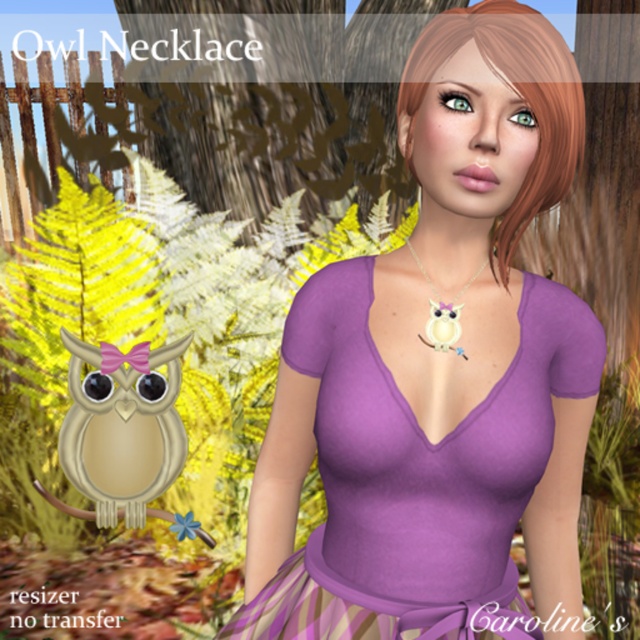
Question: Does purple matte dress at center appear on the right side of matte beige owl at center?

Choices:
 (A) no
 (B) yes

Answer: (B)

Question: Is matte beige owl at center below matte white owl at center?

Choices:
 (A) no
 (B) yes

Answer: (B)

Question: Among these objects, which one is farthest from the camera?

Choices:
 (A) matte beige owl at center
 (B) purple matte dress at center
 (C) matte white owl at center

Answer: (A)

Question: Considering the real-world distances, which object is closest to the purple matte dress at center?

Choices:
 (A) matte white owl at center
 (B) matte beige owl at center

Answer: (A)

Question: Can you confirm if purple matte dress at center is positioned above matte beige owl at center?

Choices:
 (A) no
 (B) yes

Answer: (B)

Question: Which of the following is the farthest from the observer?

Choices:
 (A) matte beige owl at center
 (B) purple matte dress at center

Answer: (A)